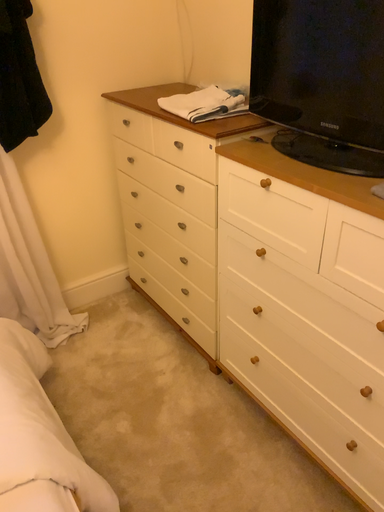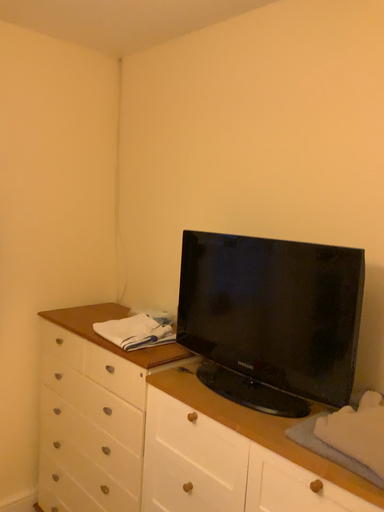
Question: How did the camera likely rotate when shooting the video?

Choices:
 (A) rotated left
 (B) rotated right

Answer: (B)